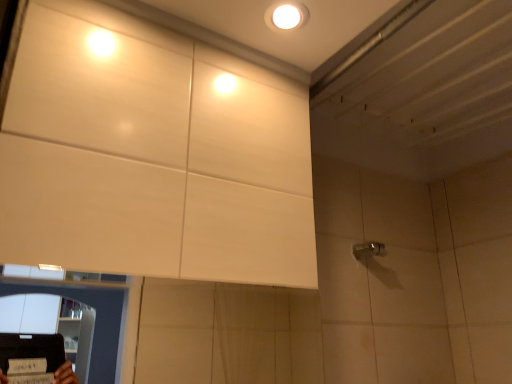
Where is `white glossy droplight at upper center`? white glossy droplight at upper center is located at coordinates (286, 16).

The image size is (512, 384). What do you see at coordinates (286, 16) in the screenshot?
I see `white glossy droplight at upper center` at bounding box center [286, 16].

Where is `satin nickel faucet at right`? Image resolution: width=512 pixels, height=384 pixels. satin nickel faucet at right is located at coordinates (368, 250).

In order to face satin nickel faucet at right, should I rotate leftwards or rightwards?

You should rotate right by 15.405 degrees.

Describe the element at coordinates (368, 250) in the screenshot. The width and height of the screenshot is (512, 384). I see `satin nickel faucet at right` at that location.

The width and height of the screenshot is (512, 384). Identify the location of white glossy droplight at upper center. (286, 16).

Considering the relative positions of white glossy droplight at upper center and satin nickel faucet at right in the image provided, is white glossy droplight at upper center to the left or to the right of satin nickel faucet at right?

From the image, it's evident that white glossy droplight at upper center is to the left of satin nickel faucet at right.

Is the position of white glossy droplight at upper center less distant than that of satin nickel faucet at right?

Yes, white glossy droplight at upper center is in front of satin nickel faucet at right.

Which is in front, point (291, 22) or point (375, 255)?

Positioned in front is point (291, 22).

From the image's perspective, relative to satin nickel faucet at right, is white glossy droplight at upper center above or below?

Based on their image positions, white glossy droplight at upper center is located above satin nickel faucet at right.

From a real-world perspective, is white glossy droplight at upper center located higher than satin nickel faucet at right?

Yes, from a real-world perspective, white glossy droplight at upper center is over satin nickel faucet at right

Considering the relative sizes of white glossy droplight at upper center and satin nickel faucet at right in the image provided, is white glossy droplight at upper center wider than satin nickel faucet at right?

Yes, white glossy droplight at upper center is wider than satin nickel faucet at right.

Considering the sizes of white glossy droplight at upper center and satin nickel faucet at right in the image, is white glossy droplight at upper center taller or shorter than satin nickel faucet at right?

Clearly, white glossy droplight at upper center is shorter compared to satin nickel faucet at right.

Which of these two, white glossy droplight at upper center or satin nickel faucet at right, is bigger?

With larger size is satin nickel faucet at right.

Is white glossy droplight at upper center inside the boundaries of satin nickel faucet at right, or outside?

white glossy droplight at upper center cannot be found inside satin nickel faucet at right.

Is white glossy droplight at upper center not near satin nickel faucet at right?

white glossy droplight at upper center is near satin nickel faucet at right, not far away.

Is white glossy droplight at upper center facing away from satin nickel faucet at right?

No, white glossy droplight at upper center's orientation is not away from satin nickel faucet at right.

Can you tell me how much white glossy droplight at upper center and satin nickel faucet at right differ in facing direction?

They differ by 1.99 degrees in their facing directions.

Measure the distance between white glossy droplight at upper center and satin nickel faucet at right.

white glossy droplight at upper center and satin nickel faucet at right are 73.63 centimeters apart.

Where is `droplight above the satin nickel faucet at right (from the image's perspective)`? droplight above the satin nickel faucet at right (from the image's perspective) is located at coordinates (286, 16).

Based on the photo, which is more to the right, satin nickel faucet at right or white glossy droplight at upper center?

Positioned to the right is satin nickel faucet at right.

Is the depth of satin nickel faucet at right greater than that of white glossy droplight at upper center?

Yes, satin nickel faucet at right is further from the viewer.

Considering the positions of points (362, 253) and (295, 24), is point (362, 253) closer to camera compared to point (295, 24)?

No.

From the image's perspective, is satin nickel faucet at right on white glossy droplight at upper center?

No, from the image's perspective, satin nickel faucet at right is not on top of white glossy droplight at upper center.

From a real-world perspective, is satin nickel faucet at right below white glossy droplight at upper center?

Yes.

Which object is wider, satin nickel faucet at right or white glossy droplight at upper center?

white glossy droplight at upper center.

Is satin nickel faucet at right taller or shorter than white glossy droplight at upper center?

In the image, satin nickel faucet at right appears to be taller than white glossy droplight at upper center.

Considering the relative sizes of satin nickel faucet at right and white glossy droplight at upper center in the image provided, is satin nickel faucet at right bigger than white glossy droplight at upper center?

Yes.

Would you say satin nickel faucet at right is inside or outside white glossy droplight at upper center?

satin nickel faucet at right is not enclosed by white glossy droplight at upper center.

Are satin nickel faucet at right and white glossy droplight at upper center located far from each other?

That's not correct — satin nickel faucet at right is a little close to white glossy droplight at upper center.

Is satin nickel faucet at right positioned with its back to white glossy droplight at upper center?

No, satin nickel faucet at right is not facing away from white glossy droplight at upper center.

You are a GUI agent. You are given a task and a screenshot of the screen. Output one action in this format:
    pyautogui.click(x=<x>, y=<y>)
    Task: Click on the shower on the right of white glossy droplight at upper center
    
    Given the screenshot: What is the action you would take?
    pyautogui.click(x=368, y=250)

Where is `droplight positioned vertically above the satin nickel faucet at right (from a real-world perspective)`? This screenshot has width=512, height=384. droplight positioned vertically above the satin nickel faucet at right (from a real-world perspective) is located at coordinates (286, 16).

Identify the location of droplight located in front of the satin nickel faucet at right. (286, 16).